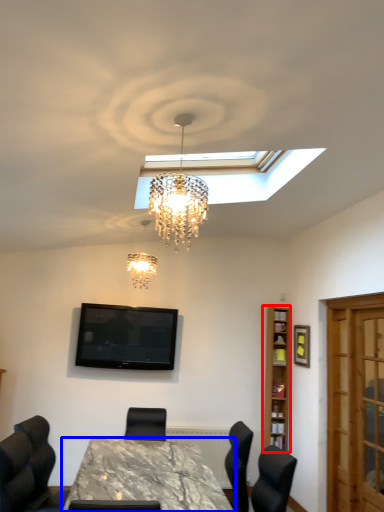
Question: Among these objects, which one is farthest to the camera, bookshelf (highlighted by a red box) or table (highlighted by a blue box)?

Choices:
 (A) bookshelf
 (B) table

Answer: (A)